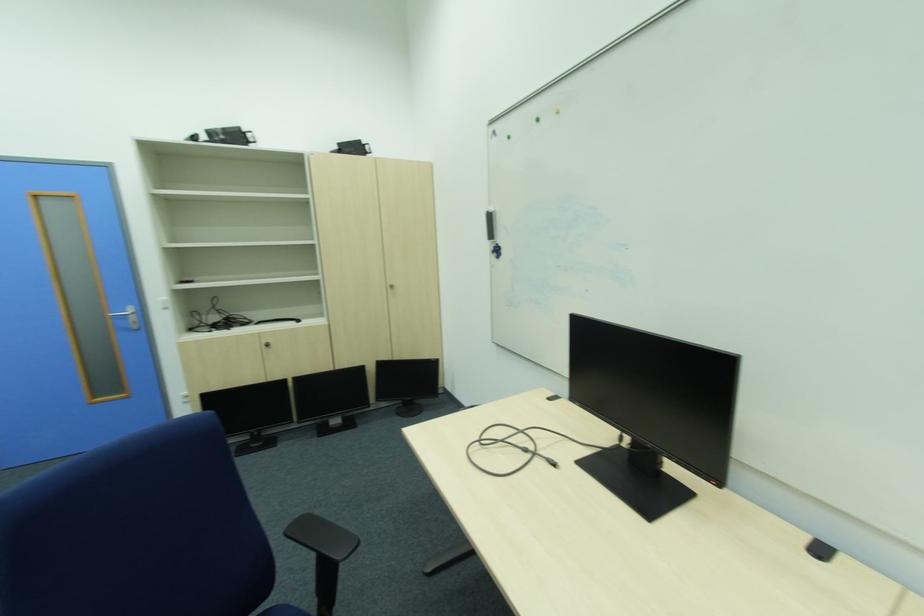
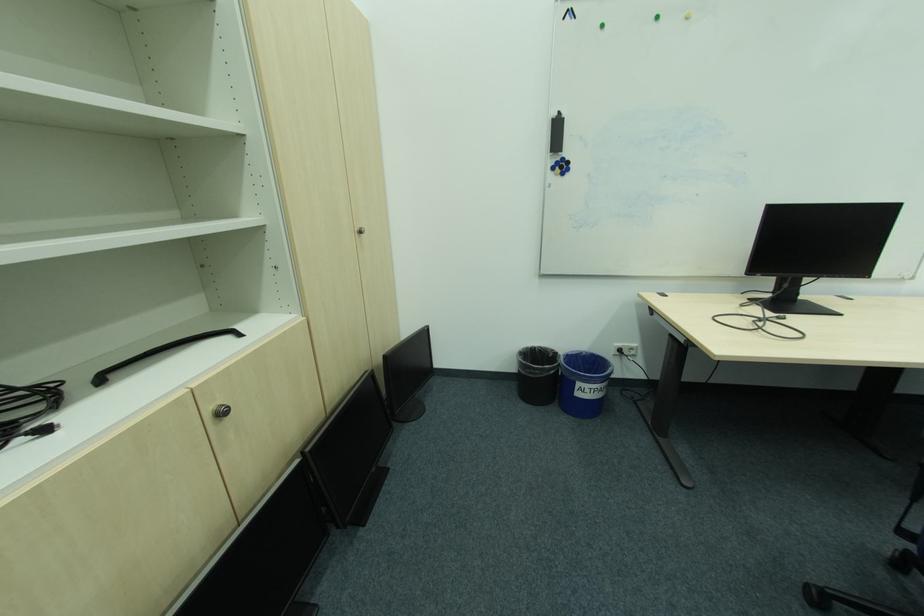
The point at (503, 248) is marked in the first image. Where is the corresponding point in the second image?

(565, 163)